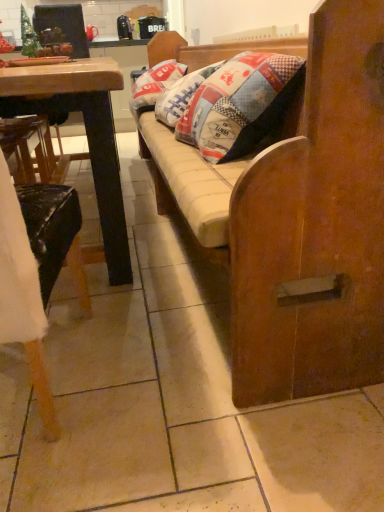
Question: From a real-world perspective, relative to green matte christmas tree at upper left, is wooden chair at left vertically above or below?

Choices:
 (A) below
 (B) above

Answer: (A)

Question: From the image's perspective, relative to green matte christmas tree at upper left, is wooden chair at left above or below?

Choices:
 (A) above
 (B) below

Answer: (B)

Question: Estimate the real-world distances between objects in this image. Which object is closer to the wooden studio couch at center?

Choices:
 (A) patchwork fabric pillow at center
 (B) green matte christmas tree at upper left
 (C) wooden desk at left
 (D) wooden chair at left

Answer: (C)

Question: Which object is the farthest from the patchwork fabric pillow at center?

Choices:
 (A) green matte christmas tree at upper left
 (B) wooden chair at left
 (C) wooden desk at left
 (D) wooden studio couch at center

Answer: (B)